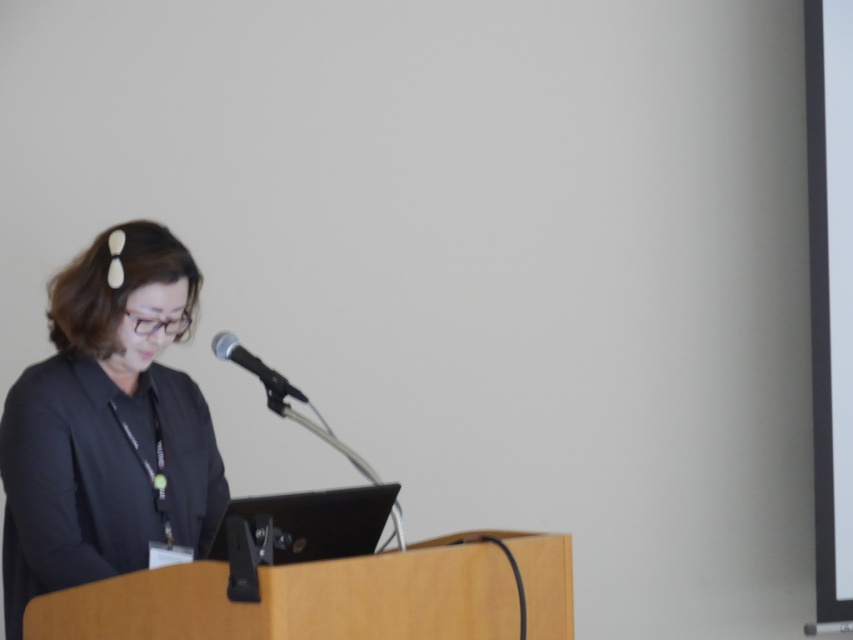
You are a photographer at the back of the room and want to take a clear photo of the black matte blazer at left and the black metallic microphone at center. However, the microphone is blocking part of the blazer. Based on their positions, can you adjust your angle to capture both objects without obstruction?

The black matte blazer at left is positioned under the black metallic microphone at center, so adjusting the camera angle slightly downward might allow capturing both without obstruction.

You are a photographer setting up for a closeup shot of the speaker. The camera you are using has a focus range of 24 centimeters. Can you focus on both the black matte blazer at left and the black metallic microphone at center without adjusting the camera position?

The black matte blazer at left and black metallic microphone at center are 24.13 centimeters apart from each other. Since the focus range is 24 centimeters, the distance between them slightly exceeds the camera focus range. Therefore, you cannot focus on both without adjusting the camera position.